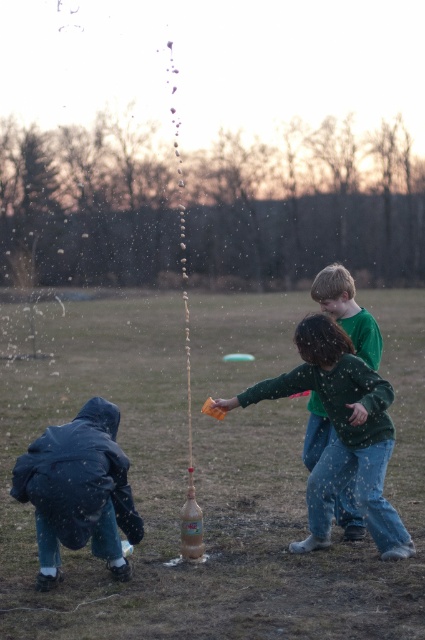
Is brown matte bottle at center wider than green cotton shirt at center?

Indeed, brown matte bottle at center has a greater width compared to green cotton shirt at center.

Which is more to the left, brown matte bottle at center or green cotton shirt at center?

Positioned to the left is brown matte bottle at center.

Image resolution: width=425 pixels, height=640 pixels. I want to click on brown matte bottle at center, so tap(209, 476).

Does green cotton shirt at center appear on the left side of green matte shirt at center?

Indeed, green cotton shirt at center is positioned on the left side of green matte shirt at center.

Which is more to the right, green cotton shirt at center or green matte shirt at center?

green matte shirt at center

Who is more distant from viewer, (323, 508) or (354, 534)?

The point (354, 534) is behind.

The height and width of the screenshot is (640, 425). In order to click on green cotton shirt at center in this screenshot , I will do `click(340, 433)`.

Find the location of a particular element. brown matte bottle at center is located at coordinates (209, 476).

Is point (105, 307) farther from camera compared to point (348, 502)?

Yes, it is.

Locate an element on the screen. Image resolution: width=425 pixels, height=640 pixels. brown matte bottle at center is located at coordinates (209, 476).

The height and width of the screenshot is (640, 425). I want to click on brown matte bottle at center, so pos(209,476).